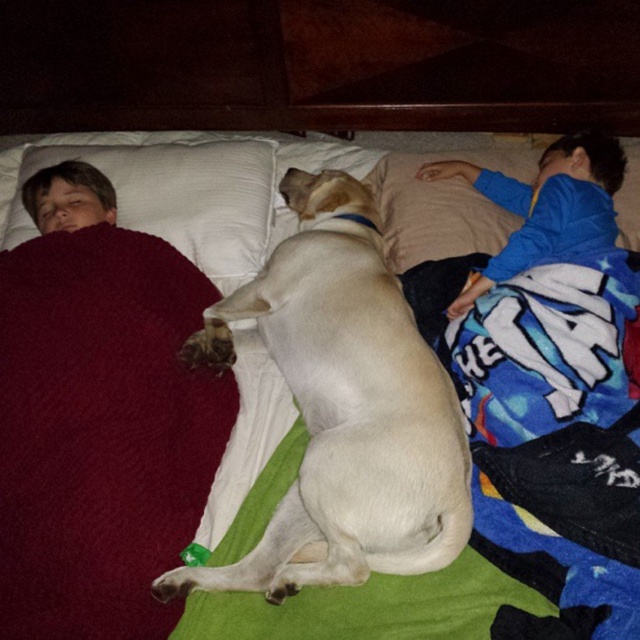
You are helping to make the bed. You need to move the white smooth dog at center and the white soft pillow at upper left to their original positions. Which object should you place first to ensure they are correctly positioned according to the original scene?

You should place the white soft pillow at upper left first because the white smooth dog at center is positioned under it in the original scene.

You are a photographer trying to capture a closeup of the dog in the image. The camera you are using has a focal length of 50mm and a sensor size of 24x36mm. The dog is positioned at point (342,406) in the image coordinates. To ensure the dog fills the frame, you need to calculate the minimum distance you should be from the dog. The formula for calculating the minimum distance is sensor size divided by 2 multiplied by the focal length divided by the field of view. However, the field of view here is 60.34

The point (342,406) is on the white smooth dog at center. Using the formula, the minimum distance required would be calculated as follows...

You are a robotic pet feeder that needs to place a small treat between the white smooth dog at center and the white soft pillow at upper left. Can you fit the treat in the space between them?

The distance between the white smooth dog at center and the white soft pillow at upper left is 13.71 inches, so yes, the robotic pet feeder can fit the treat in the space between them since the distance is sufficient.